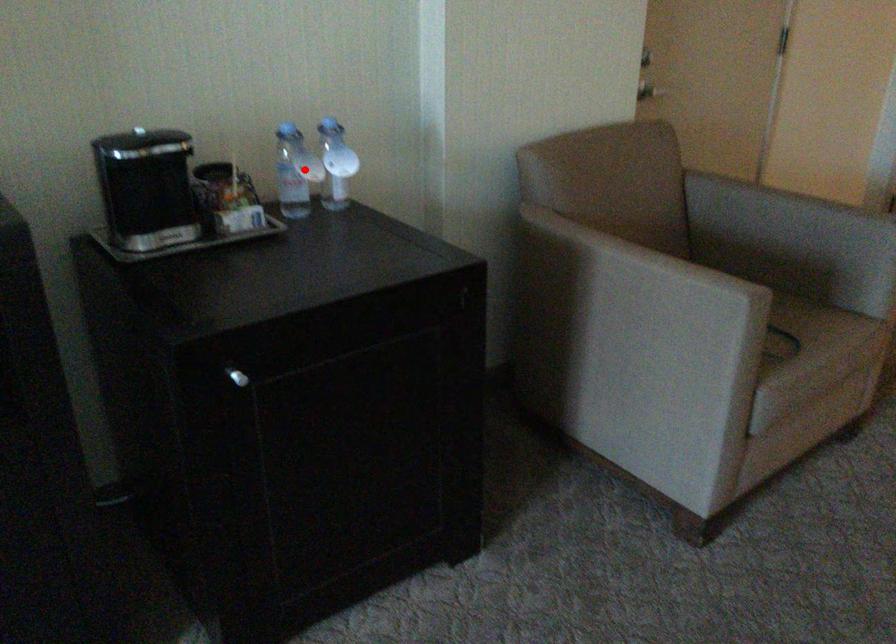
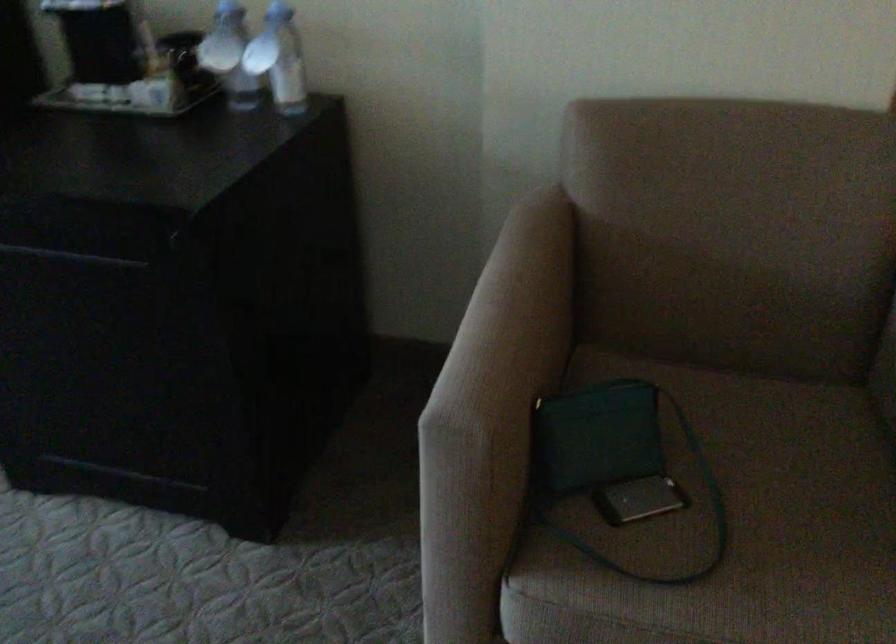
Where in the second image is the point corresponding to the highlighted location from the first image?

(229, 55)